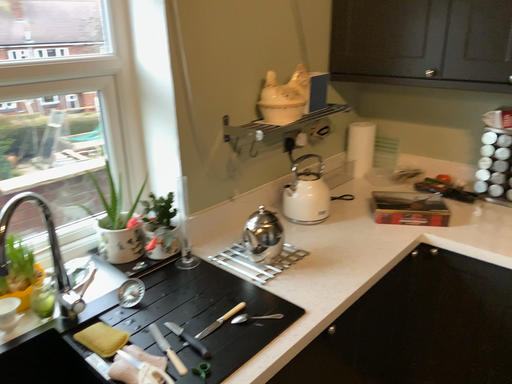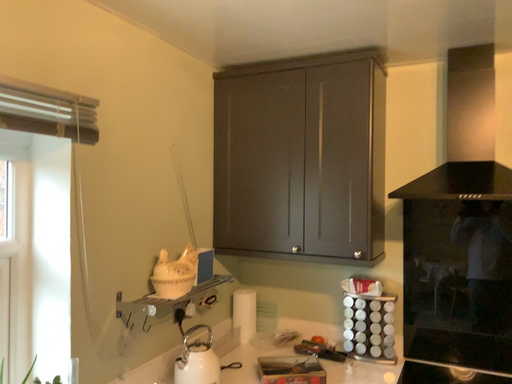
Question: How did the camera likely rotate when shooting the video?

Choices:
 (A) rotated upward
 (B) rotated downward

Answer: (A)